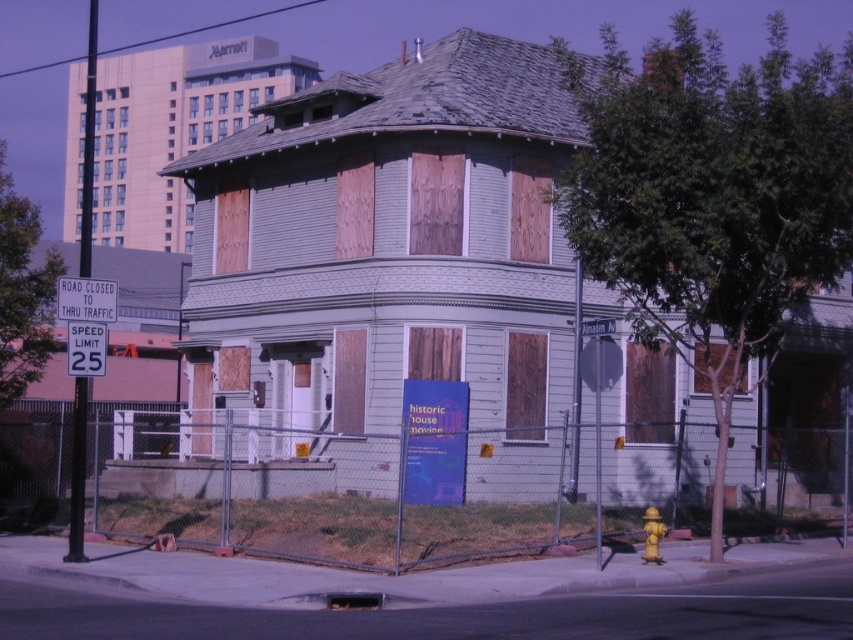
Does white plastic road sign at upper left have a larger size compared to yellow metallic hydrant at lower right?

Yes.

In the scene shown: Is white plastic road sign at upper left positioned behind yellow metallic hydrant at lower right?

Yes, white plastic road sign at upper left is behind yellow metallic hydrant at lower right.

This screenshot has width=853, height=640. In order to click on white plastic road sign at upper left in this screenshot , I will do `click(86, 300)`.

You are a GUI agent. You are given a task and a screenshot of the screen. Output one action in this format:
    pyautogui.click(x=<x>, y=<y>)
    Task: Click on the white plastic road sign at upper left
    This screenshot has height=640, width=853.
    Given the screenshot: What is the action you would take?
    click(x=86, y=300)

Looking at this image, can you confirm if metal speed limit sign at left is shorter than yellow metallic hydrant at lower right?

No.

Describe the element at coordinates (86, 348) in the screenshot. I see `metal speed limit sign at left` at that location.

Between point (91, 326) and point (660, 538), which one is positioned in front?

Point (91, 326)

Locate an element on the screen. The width and height of the screenshot is (853, 640). metal speed limit sign at left is located at coordinates (86, 348).

Can you confirm if white plastic road sign at upper left is bigger than metal speed limit sign at left?

Yes.

Where is `white plastic road sign at upper left`? The width and height of the screenshot is (853, 640). white plastic road sign at upper left is located at coordinates (86, 300).

Does point (57, 301) come farther from viewer compared to point (102, 355)?

No, it is in front of (102, 355).

Where is `white plastic road sign at upper left`? white plastic road sign at upper left is located at coordinates (86, 300).